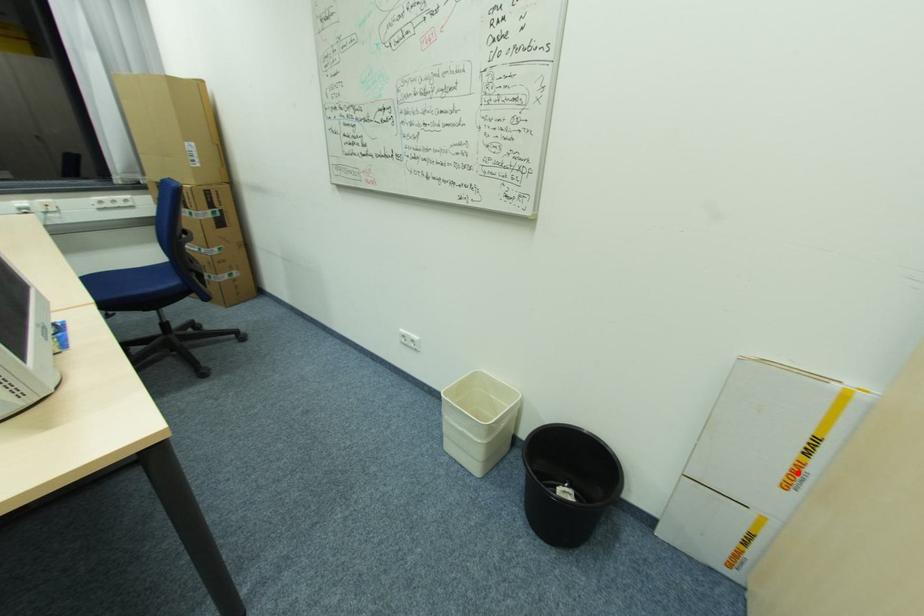
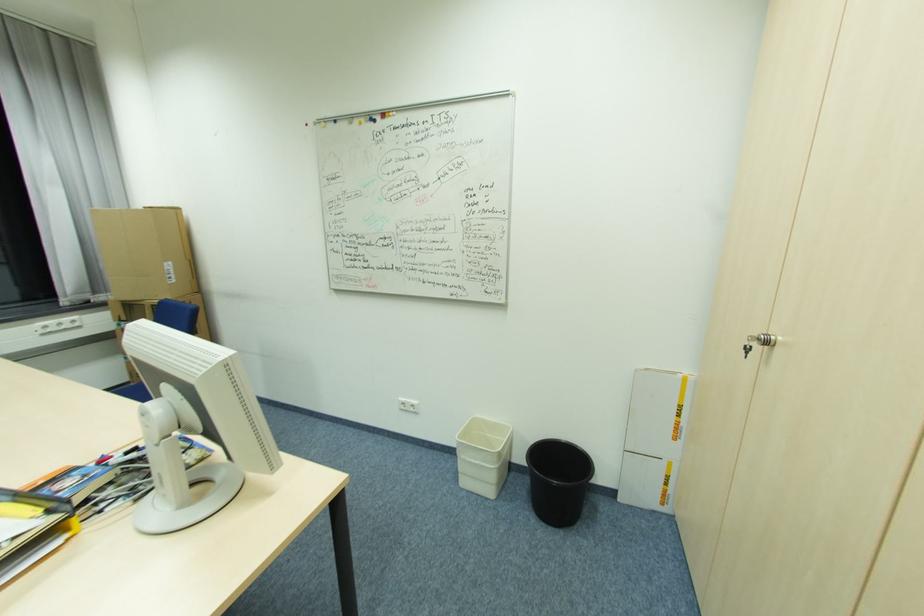
Locate, in the second image, the point that corresponds to the highlighted location in the first image.

(681, 430)